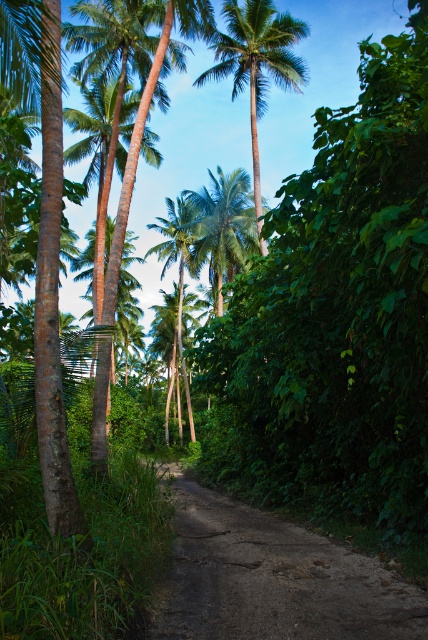
Question: From the image, what is the correct spatial relationship of dirt road at center in relation to green leafy palm tree at upper center?

Choices:
 (A) below
 (B) above

Answer: (A)

Question: Can you confirm if dirt road at center is smaller than green leafy palm tree at center?

Choices:
 (A) yes
 (B) no

Answer: (A)

Question: Which object is positioned closest to the green leafy palm tree at upper center?

Choices:
 (A) green leafy palm tree at center
 (B) dirt road at center

Answer: (A)

Question: Observing the image, what is the correct spatial positioning of dirt road at center in reference to green leafy palm tree at upper center?

Choices:
 (A) below
 (B) above

Answer: (A)

Question: Which point is farther to the camera?

Choices:
 (A) green leafy palm tree at upper center
 (B) dirt road at center

Answer: (A)

Question: Which is farther from the green leafy palm tree at upper center?

Choices:
 (A) green leafy palm tree at center
 (B) dirt road at center

Answer: (B)